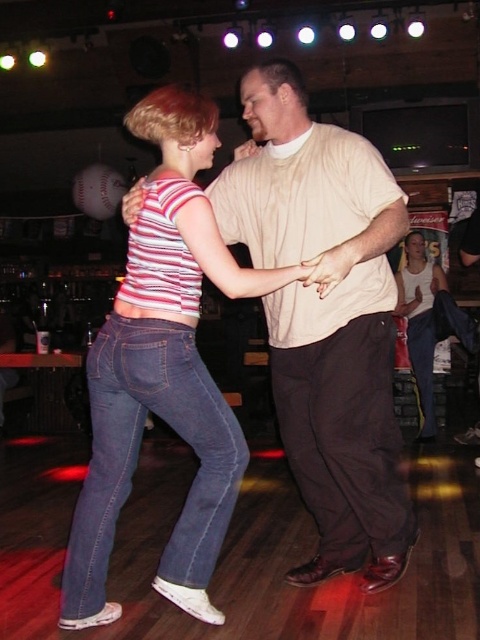
You are a photographer standing in the bar and want to capture a photo of the denim jeans at lower left and the matte beige shirt at center. Which object should you focus on first if you want to ensure both are in focus without adjusting your camera settings?

The denim jeans at lower left is taller than the matte beige shirt at center, so focusing on the denim jeans at lower left first will help ensure both are in focus since it is the larger object in the frame.

You are standing at the entrance of the bar and want to take a photo of the two dancers. The first dancer is at point (430, 396) and the second dancer is at point (478, 252). Which dancer is closer to your camera?

Point (430, 396) is further to the camera than point (478, 252). Therefore, the second dancer at point (478, 252) is closer to the camera.